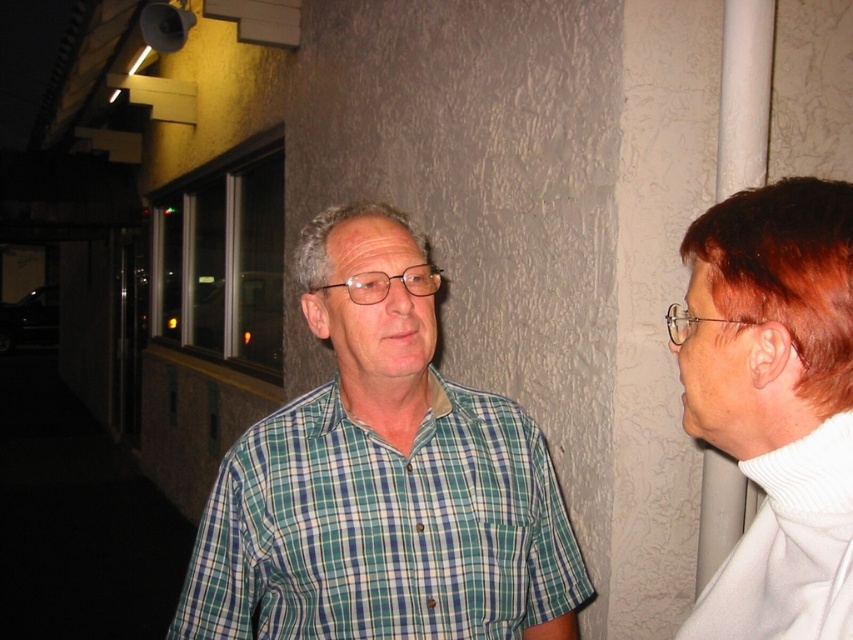
Who is positioned more to the left, white ribbed sweater at right or gray matte hair at center?

gray matte hair at center

Which is behind, point (756, 458) or point (392, 211)?

The point (392, 211) is more distant.

Locate an element on the screen. The height and width of the screenshot is (640, 853). white ribbed sweater at right is located at coordinates (788, 548).

In the scene shown: Who is higher up, white fleece at right or white ribbed sweater at right?

Positioned higher is white fleece at right.

Which is more to the left, white fleece at right or white ribbed sweater at right?

From the viewer's perspective, white ribbed sweater at right appears more on the left side.

Is point (759, 460) in front of point (769, 493)?

No.

Identify the location of white fleece at right. (776, 401).

Looking at this image, is green plaid shirt at center wider than white fleece at right?

Correct, the width of green plaid shirt at center exceeds that of white fleece at right.

Is green plaid shirt at center to the left of white fleece at right from the viewer's perspective?

Indeed, green plaid shirt at center is positioned on the left side of white fleece at right.

Locate an element on the screen. The image size is (853, 640). green plaid shirt at center is located at coordinates pyautogui.click(x=381, y=477).